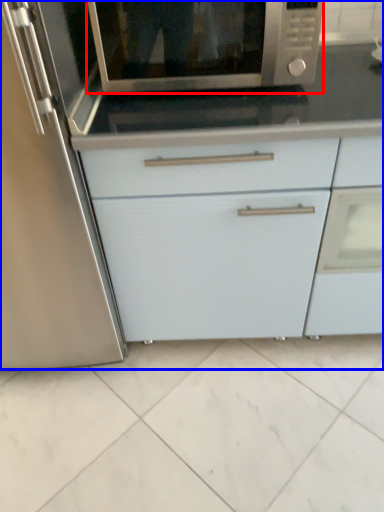
Question: Which point is further to the camera, microwave oven (highlighted by a red box) or cabinetry (highlighted by a blue box)?

Choices:
 (A) microwave oven
 (B) cabinetry

Answer: (B)